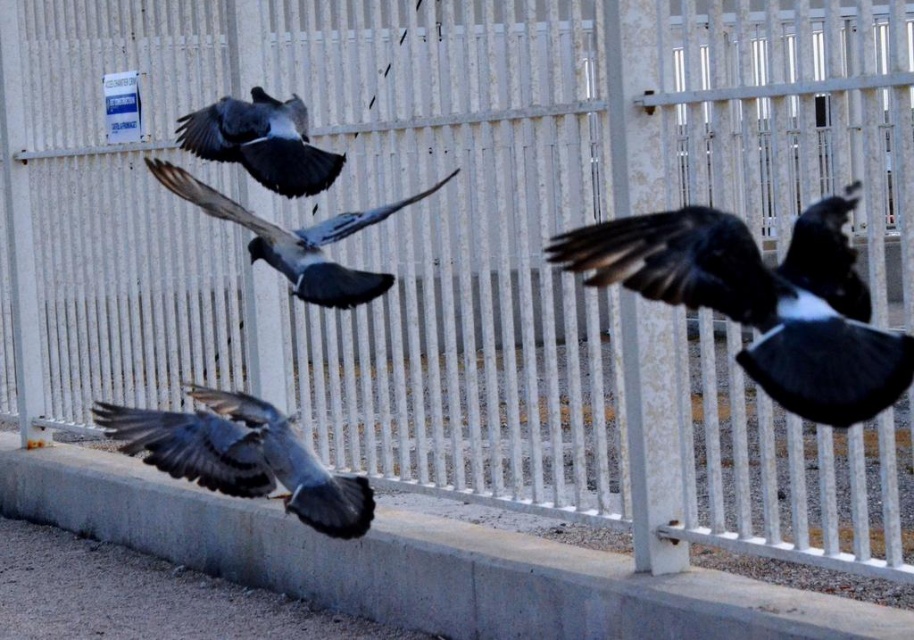
You are observing two points in the image of the pigeons flying near the fence. Which point, point (856, 300) or point (304, 244), is nearer to your viewpoint?

Point (856, 300) is closer to the camera than point (304, 244).

Looking at the scene with the metal fence and pigeons in flight, where is the black glossy bird at right in relation to the gray matte pigeon at upper center?

The black glossy bird at right is positioned to the right of the gray matte pigeon at upper center.